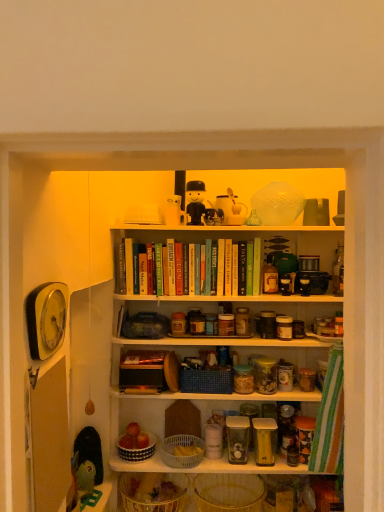
Question: In the image, is black-and-white ceramic bowl at center, the fourth basket when ordered from bottom to top, positioned in front of or behind yellow wicker basket at lower center, acting as the fourth basket starting from the top?

Choices:
 (A) front
 (B) behind

Answer: (B)

Question: From a real-world perspective, is black-and-white ceramic bowl at center, the fourth basket when ordered from bottom to top, above or below yellow wicker basket at lower center, acting as the fourth basket starting from the top?

Choices:
 (A) below
 (B) above

Answer: (B)

Question: Estimate the real-world distances between objects in this image. Which object is closer to the yellow wicker basket at lower center, placed as the second basket when sorted from bottom to top?

Choices:
 (A) matte plastic toy at upper center, the 1th toy viewed from the back
 (B) translucent wicker basket at lower center, marked as the 5th basket in a top-to-bottom arrangement
 (C) matte plastic toy at upper center, which appears as the second toy when viewed from the back
 (D) black-and-white ceramic bowl at center, which appears as the 2th basket when viewed from the top
 (E) blue woven basket at center, the 1th basket when ordered from top to bottom

Answer: (B)

Question: Which is nearer to the green plastic toy at lower left, positioned as the second toy in bottom-to-top order?

Choices:
 (A) green plastic toy at lower left, the first toy positioned from the left
 (B) black-and-white ceramic bowl at center, the fourth basket when ordered from bottom to top
 (C) matte plastic toy at upper center, the 4th toy positioned from the front
 (D) white plastic basket at center, the third basket when ordered from bottom to top
 (E) clear glass jar at center

Answer: (A)